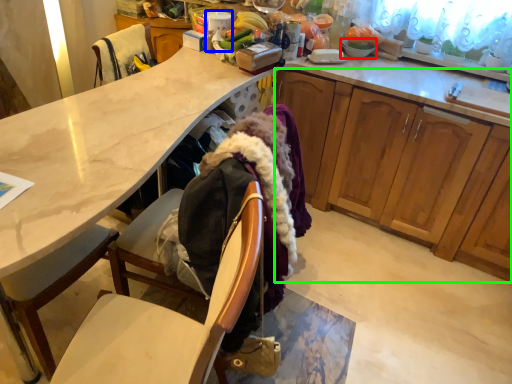
Question: Estimate the real-world distances between objects in this image. Which object is closer to tableware (highlighted by a red box), kitchen appliance (highlighted by a blue box) or cabinetry (highlighted by a green box)?

Choices:
 (A) kitchen appliance
 (B) cabinetry

Answer: (B)